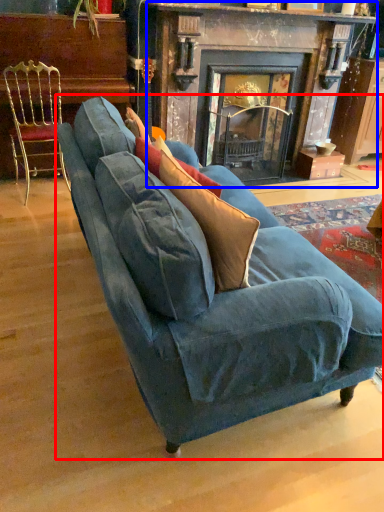
Question: Which of the following is the farthest to the observer, studio couch (highlighted by a red box) or fireplace (highlighted by a blue box)?

Choices:
 (A) studio couch
 (B) fireplace

Answer: (B)